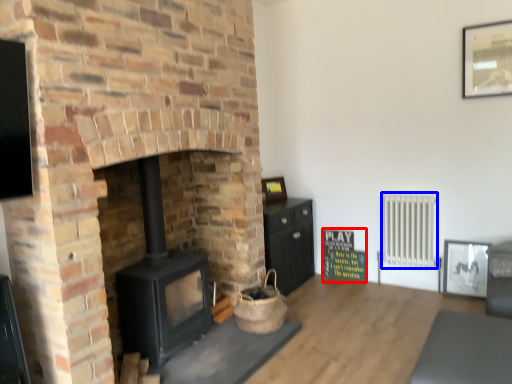
Question: Among these objects, which one is farthest to the camera, bulletin board (highlighted by a red box) or radiator (highlighted by a blue box)?

Choices:
 (A) bulletin board
 (B) radiator

Answer: (A)